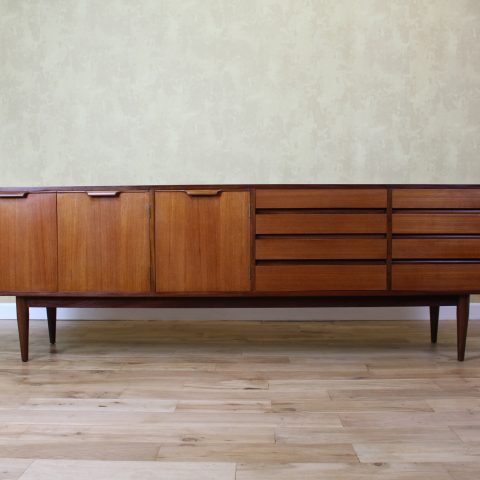
Where is `wooden door pulls`? This screenshot has width=480, height=480. wooden door pulls is located at coordinates (16, 194), (101, 192), (201, 193).